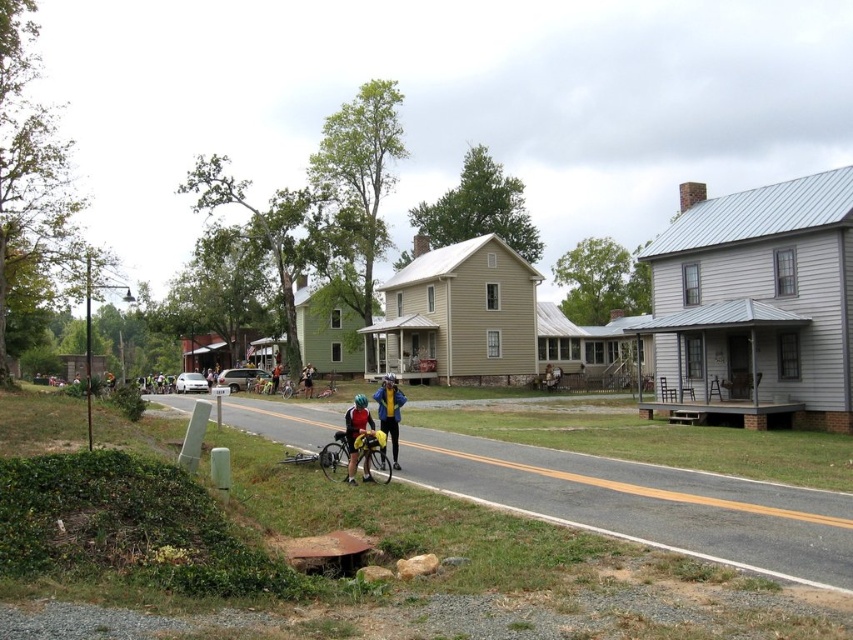
You are a pedestrian standing on the road and see the yellow fabric jacket at center and the shiny black bicycle at center. Which object is closer to you?

The yellow fabric jacket at center is closer to you because it is in front of the shiny black bicycle at center.

You are a cyclist approaching the matte yellow helmet at center and the orange reflective vest at center on the road. Which object will you encounter first?

The matte yellow helmet at center is in front of the orange reflective vest at center, so you will encounter the matte yellow helmet at center first.

You are a delivery person standing on the two lane road in the rural scene. You see a yellow fabric jacket at center and a shiny black bicycle at center. Which object is taller?

The yellow fabric jacket at center is taller than the shiny black bicycle at center.